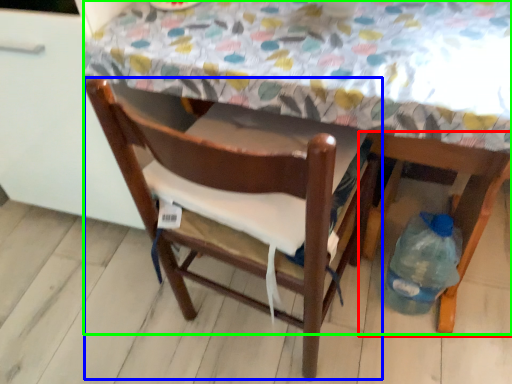
Question: Which object is positioned farthest from chair (highlighted by a red box)? Select from chair (highlighted by a blue box) and table (highlighted by a green box).

Choices:
 (A) chair
 (B) table

Answer: (B)